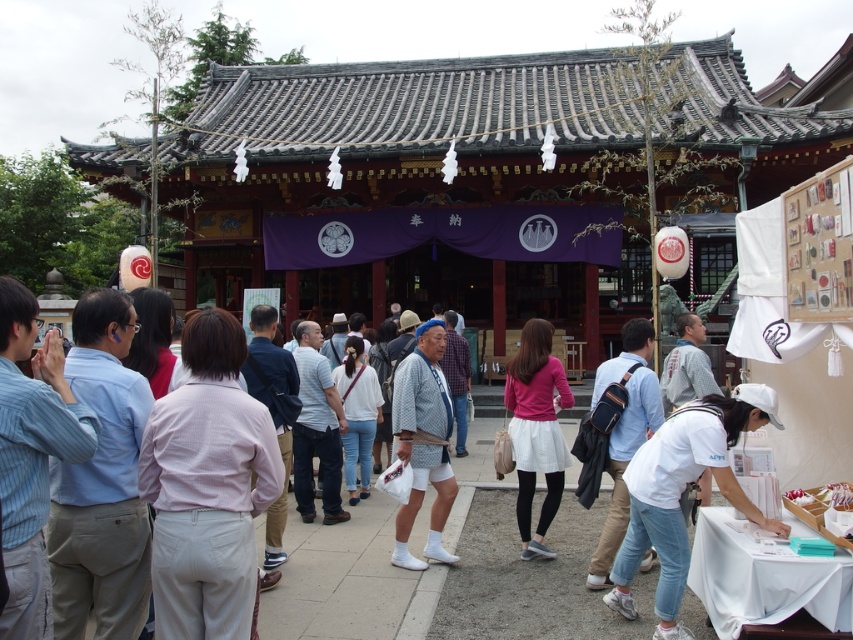
Is point (10, 378) farther from viewer compared to point (537, 420)?

No, (10, 378) is closer to viewer.

Is point (86, 440) positioned before point (538, 332)?

Yes.

Image resolution: width=853 pixels, height=640 pixels. Find the location of `blue striped shirt at left`. blue striped shirt at left is located at coordinates (32, 456).

Does blue striped shirt at left have a greater height compared to pink shirt at center?

Correct, blue striped shirt at left is much taller as pink shirt at center.

Which is in front, point (22, 454) or point (268, 376)?

Point (22, 454) is in front.

At what (x,y) coordinates should I click in order to perform the action: click on blue striped shirt at left. Please return your answer as a coordinate pair (x, y). Looking at the image, I should click on (32, 456).

Based on the photo, which of these two, light blue striped shirt at center or white cotton shirt at center, stands taller?

With more height is light blue striped shirt at center.

This screenshot has width=853, height=640. Identify the location of light blue striped shirt at center. (316, 428).

Is point (328, 509) positioned behind point (363, 385)?

No.

At what (x,y) coordinates should I click in order to perform the action: click on light blue striped shirt at center. Please return your answer as a coordinate pair (x, y). Looking at the image, I should click on [x=316, y=428].